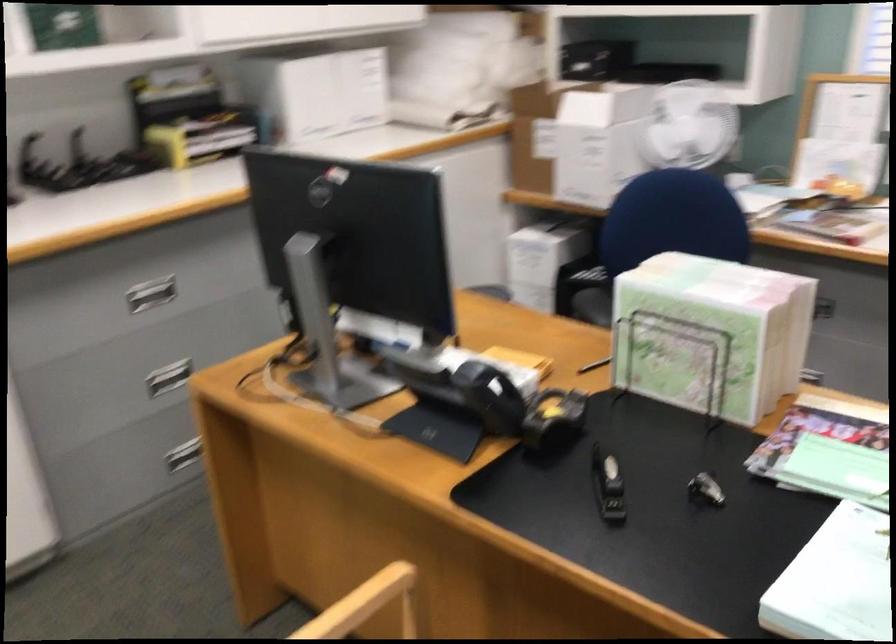
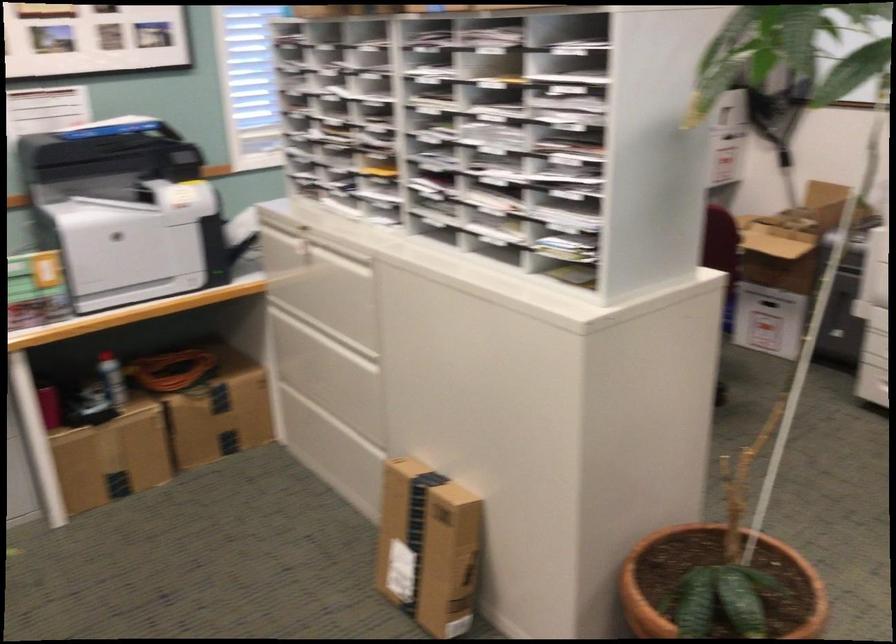
Question: The images are taken continuously from a first-person perspective. In which direction is your viewpoint rotating?

Choices:
 (A) Left
 (B) Right
 (C) Up
 (D) Down

Answer: (B)